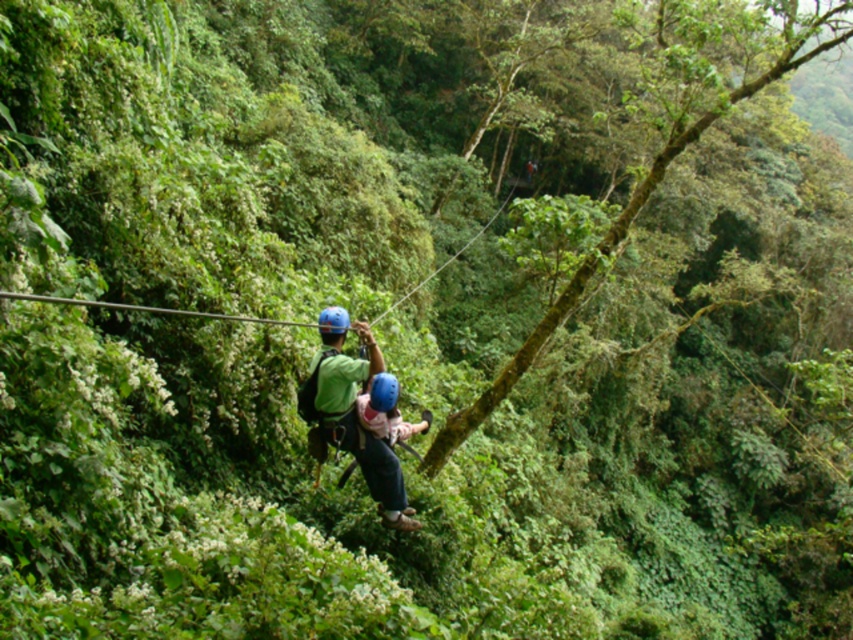
Question: Can you confirm if green fabric harness at center is positioned to the left of blue matte helmet at center?

Choices:
 (A) yes
 (B) no

Answer: (A)

Question: Which point appears closest to the camera in this image?

Choices:
 (A) (844, 36)
 (B) (358, 403)

Answer: (B)

Question: Does green fabric harness at center have a larger size compared to blue matte helmet at center?

Choices:
 (A) yes
 (B) no

Answer: (A)

Question: Is green fabric harness at center to the left of blue matte helmet at center from the viewer's perspective?

Choices:
 (A) no
 (B) yes

Answer: (B)

Question: Which object is positioned farthest from the green mossy tree at center?

Choices:
 (A) green fabric harness at center
 (B) blue matte helmet at center

Answer: (B)

Question: Which object is positioned closest to the blue matte helmet at center?

Choices:
 (A) green fabric harness at center
 (B) green mossy tree at center

Answer: (A)